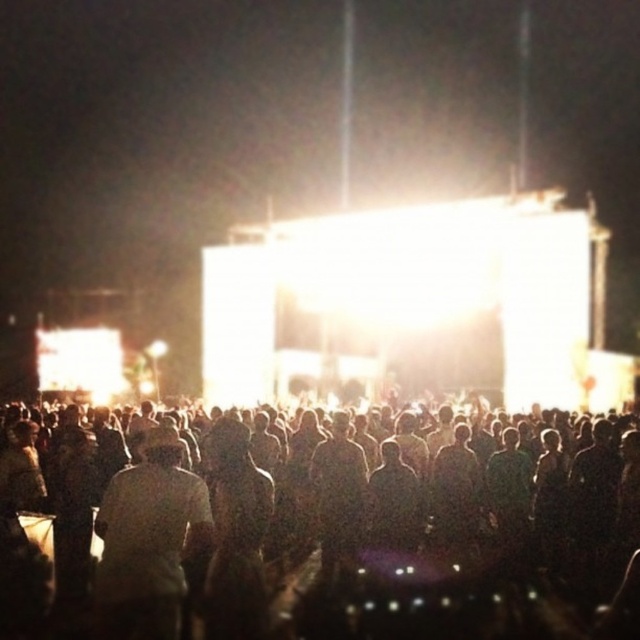
Does dark silhouettes at center have a lesser width compared to white matte shirt at center?

No, dark silhouettes at center is not thinner than white matte shirt at center.

Between dark silhouettes at center and white matte shirt at center, which one appears on the left side from the viewer's perspective?

Positioned to the left is white matte shirt at center.

Who is more distant from viewer, (316, 625) or (163, 608)?

Positioned behind is point (316, 625).

Where is `dark silhouettes at center`? The image size is (640, 640). dark silhouettes at center is located at coordinates point(360,538).